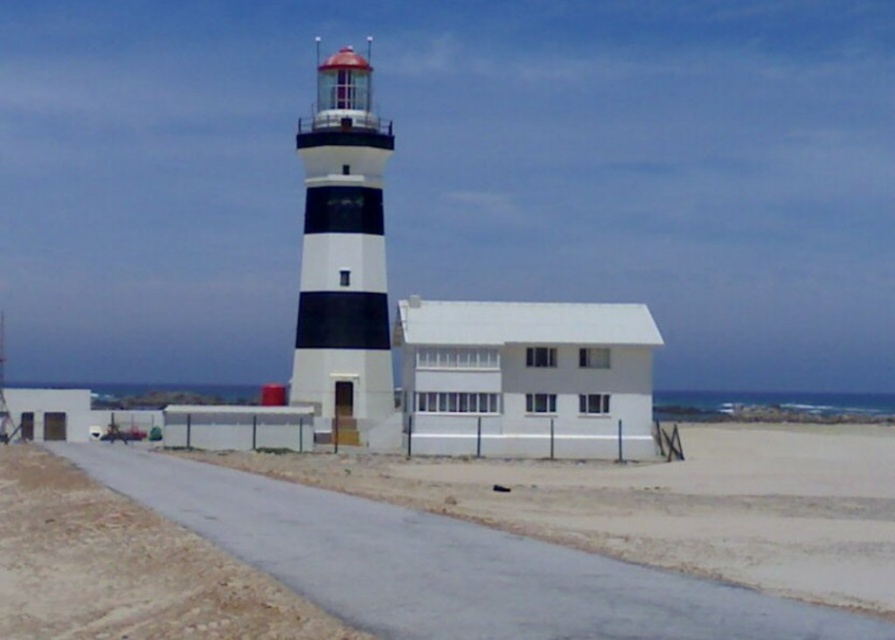
What is the exact coordinate of the brown gravel at lower center?

The brown gravel at lower center is located at point (125, 568).

You are standing at the edge of the beach and see the brown gravel at lower center and the black and white striped lighthouse at center. Which object is closer to your right side?

The brown gravel at lower center is to the right of the black and white striped lighthouse at center, so it is closer to your right side.

You are standing on the sandy beach at lower center and want to reach the black and white striped lighthouse at center. If your walking speed is 1.5 meters per second, how many seconds will it take you to reach the lighthouse?

The distance between the sandy beach at lower center and the black and white striped lighthouse at center is 31.53 meters. At a walking speed of 1.5 meters per second, it will take approximately 21.02 seconds to reach the lighthouse.